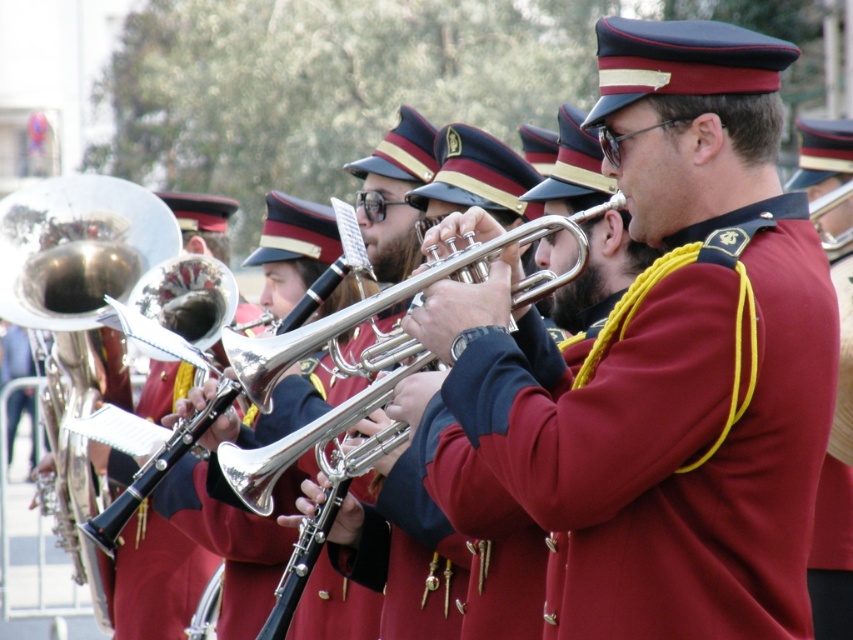
Question: Can you confirm if maroon fabric uniform at center is positioned to the right of shiny brass trumpet at center?

Choices:
 (A) yes
 (B) no

Answer: (A)

Question: Observing the image, what is the correct spatial positioning of maroon fabric uniform at center in reference to shiny brass trumpet at center?

Choices:
 (A) right
 (B) left

Answer: (A)

Question: Estimate the real-world distances between objects in this image. Which object is farther from the shiny brass trumpet at center?

Choices:
 (A) silver shiny trumpet at center
 (B) maroon fabric uniform at center

Answer: (B)

Question: Is maroon fabric uniform at center closer to camera compared to silver shiny trumpet at center?

Choices:
 (A) yes
 (B) no

Answer: (A)

Question: Which of the following is the closest to the observer?

Choices:
 (A) (596, 214)
 (B) (635, 301)

Answer: (B)

Question: Which object is positioned closest to the maroon fabric uniform at center?

Choices:
 (A) silver shiny trumpet at center
 (B) shiny brass trumpet at center

Answer: (A)